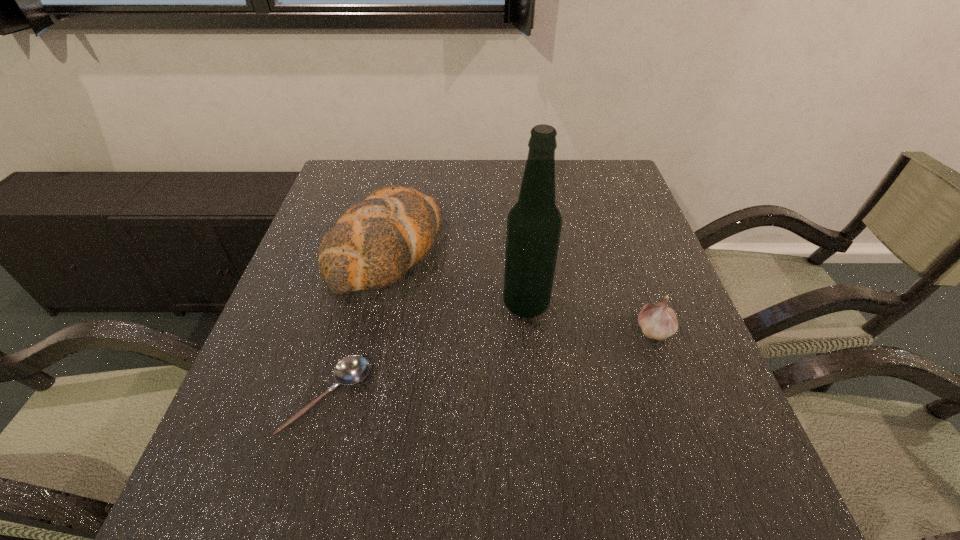
The height and width of the screenshot is (540, 960). Identify the location of free space that satisfies the following two spatial constraints: 1. on the back side of the shortest object; 2. on the left side of the tallest object. pos(353,304).